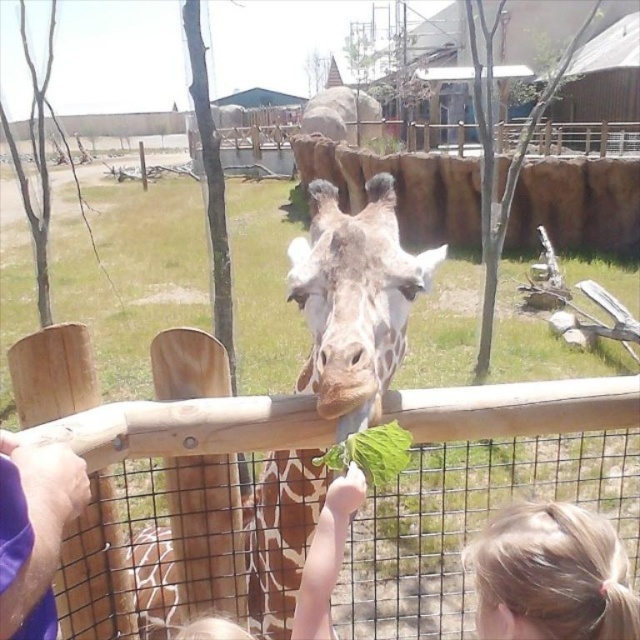
You are a zookeeper standing at the point marked with a red dot at coordinate point [253,592]. You need to reach the giraffe feeding area, which is 1.86 meters away from your current position. If you walk straight ahead, will you reach the feeding area before the fence ends? The fence is 2 meters long and runs parallel to your path.

Since the distance to the feeding area is 1.86 meters and the fence is 2 meters long, you will reach the feeding area before the fence ends because 1.86 meters is less than the total fence length of 2 meters.

You are standing in front of the giraffe enclosure and want to take a photo of the two points mentioned. Which point, point (332,305) or point (0,452), is closer to your camera?

Point (0,452) is closer to the camera because it is less further away than point (332,305).